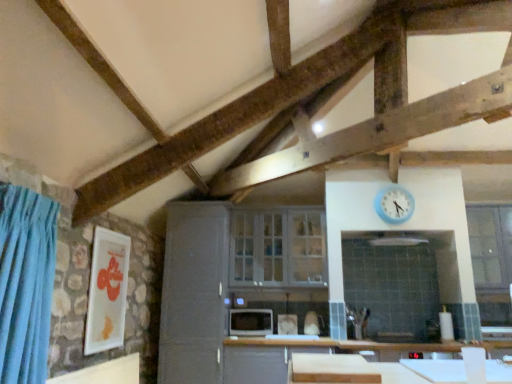
Question: Should I look upward or downward to see blue plastic clock at upper right?

Choices:
 (A) down
 (B) up

Answer: (A)

Question: Is white matte cutting board at lower center wider than clear glass window at right, acting as the first window starting from the right?

Choices:
 (A) yes
 (B) no

Answer: (A)

Question: From a real-world perspective, is white matte cutting board at lower center beneath clear glass window at right, positioned as the 2th window in left-to-right order?

Choices:
 (A) no
 (B) yes

Answer: (B)

Question: Is white matte cutting board at lower center thinner than clear glass window at right, acting as the first window starting from the right?

Choices:
 (A) yes
 (B) no

Answer: (B)

Question: Is white matte cutting board at lower center at the right side of clear glass window at right, positioned as the 2th window in left-to-right order?

Choices:
 (A) yes
 (B) no

Answer: (B)

Question: Can we say white matte cutting board at lower center lies outside clear glass window at right, acting as the first window starting from the right?

Choices:
 (A) yes
 (B) no

Answer: (A)

Question: Does white matte cutting board at lower center turn towards clear glass window at right, acting as the first window starting from the right?

Choices:
 (A) no
 (B) yes

Answer: (A)

Question: Is matte black microwave at center positioned beyond the bounds of satin gray cabinet at center?

Choices:
 (A) yes
 (B) no

Answer: (A)

Question: From the image's perspective, is matte black microwave at center located beneath satin gray cabinet at center?

Choices:
 (A) yes
 (B) no

Answer: (A)

Question: Is matte black microwave at center shorter than satin gray cabinet at center?

Choices:
 (A) yes
 (B) no

Answer: (A)

Question: Does matte black microwave at center appear on the right side of satin gray cabinet at center?

Choices:
 (A) yes
 (B) no

Answer: (A)

Question: From a real-world perspective, is matte black microwave at center located beneath satin gray cabinet at center?

Choices:
 (A) yes
 (B) no

Answer: (A)

Question: Would you say matte black microwave at center contains satin gray cabinet at center?

Choices:
 (A) yes
 (B) no

Answer: (B)

Question: Is white matte cutting board at lower center surrounded by matte black microwave at center?

Choices:
 (A) no
 (B) yes

Answer: (A)